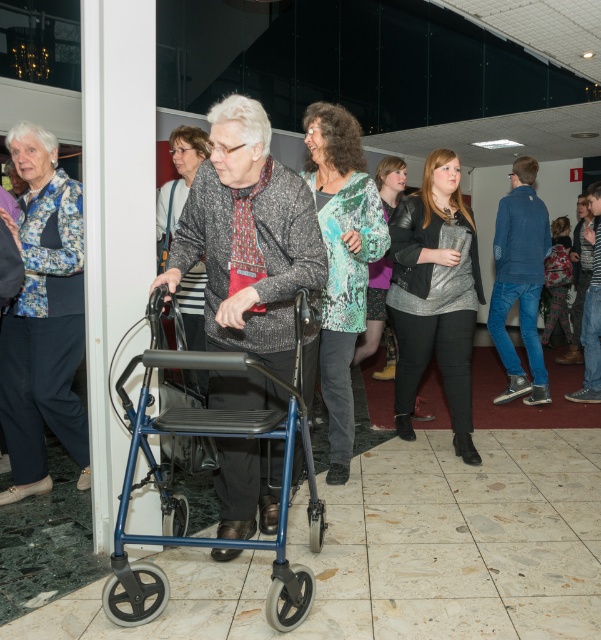
Is floral fabric jacket at upper left below leather jacket at center?

Yes, floral fabric jacket at upper left is below leather jacket at center.

Between point (78, 461) and point (456, 417), which one is positioned behind?

The point (456, 417) is behind.

Where is `floral fabric jacket at upper left`? Image resolution: width=601 pixels, height=640 pixels. floral fabric jacket at upper left is located at coordinates (43, 317).

Which is in front, point (231, 236) or point (297, 394)?

Point (297, 394) is more forward.

Is point (272, 282) closer to viewer compared to point (129, 621)?

That is False.

In the scene shown: Who is more distant from viewer, (182, 221) or (206, 426)?

Positioned behind is point (182, 221).

Locate an element on the screen. The width and height of the screenshot is (601, 640). metallic walker at center is located at coordinates (248, 237).

Is leather jacket at center closer to the viewer compared to denim jacket at center?

Yes, leather jacket at center is in front of denim jacket at center.

Who is more forward, (432,324) or (597,244)?

Positioned in front is point (432,324).

At what (x,y) coordinates should I click in order to perform the action: click on leather jacket at center. Please return your answer as a coordinate pair (x, y). The height and width of the screenshot is (640, 601). Looking at the image, I should click on (435, 296).